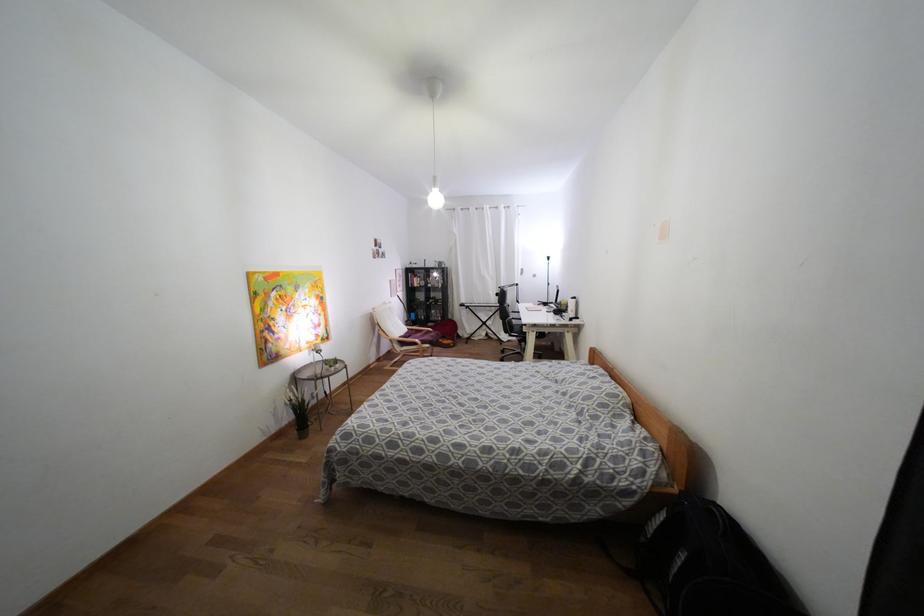
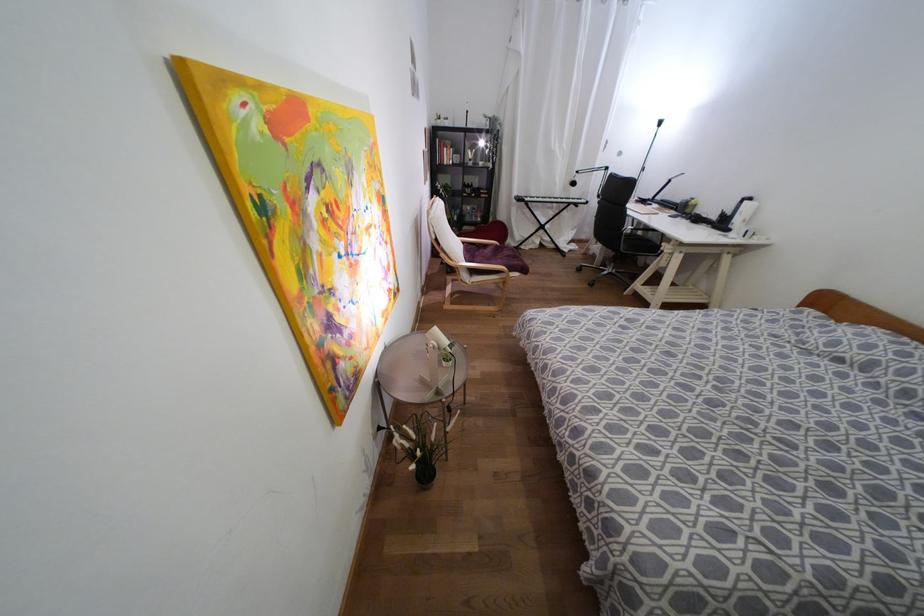
What movement of the cameraman would produce the second image?

The cameraman walked toward left, forward.